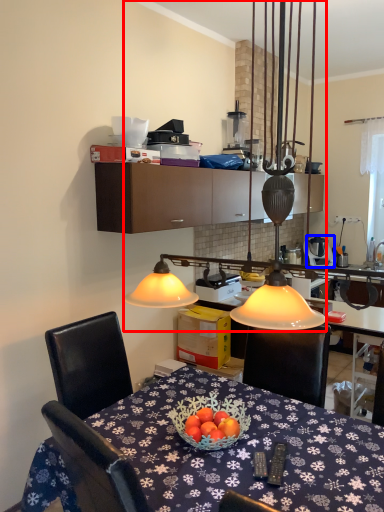
Question: Which object appears farthest to the camera in this image, lamp (highlighted by a red box) or appliance (highlighted by a blue box)?

Choices:
 (A) lamp
 (B) appliance

Answer: (B)